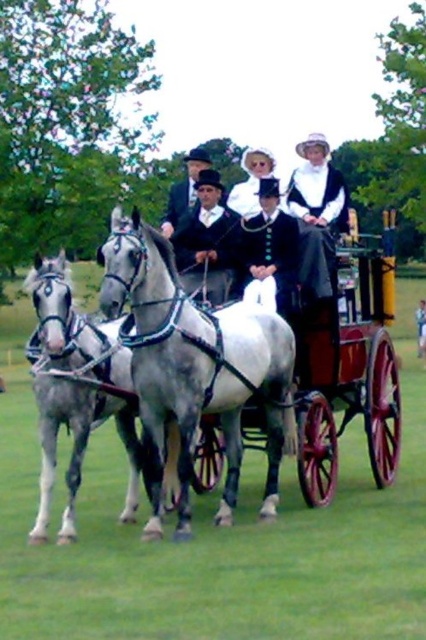
Between gray glossy horse at center and white lace dress at center, which one appears on the left side from the viewer's perspective?

From the viewer's perspective, gray glossy horse at center appears more on the left side.

Between point (160, 378) and point (311, 145), which one is positioned behind?

The point (311, 145) is more distant.

Where is `gray glossy horse at center`? Image resolution: width=426 pixels, height=640 pixels. gray glossy horse at center is located at coordinates (195, 368).

Does gray glossy horse at center appear over smooth leather coach at center?

Actually, gray glossy horse at center is below smooth leather coach at center.

Between gray glossy horse at center and smooth leather coach at center, which one is positioned higher?

smooth leather coach at center is higher up.

What do you see at coordinates (195, 368) in the screenshot?
I see `gray glossy horse at center` at bounding box center [195, 368].

Where is `gray glossy horse at center`? gray glossy horse at center is located at coordinates (195, 368).

The width and height of the screenshot is (426, 640). What do you see at coordinates (195, 368) in the screenshot?
I see `gray glossy horse at center` at bounding box center [195, 368].

Does point (135, 268) come farther from viewer compared to point (88, 419)?

That is False.

Find the location of a particular element. gray glossy horse at center is located at coordinates (195, 368).